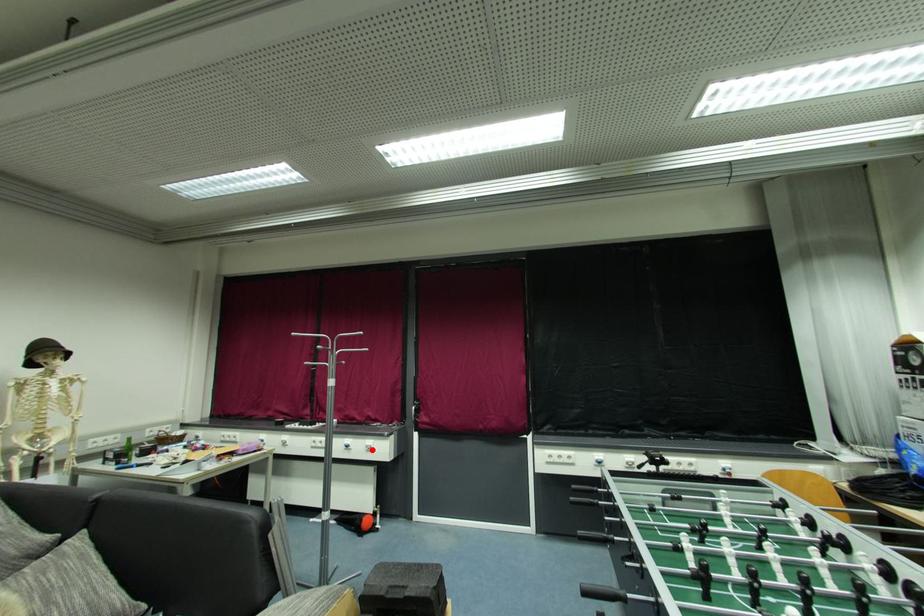
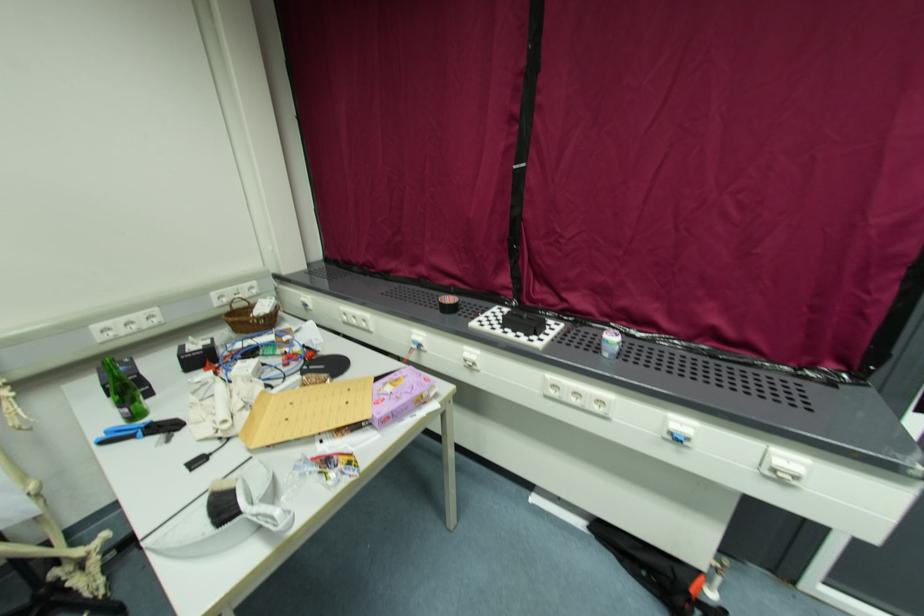
Locate, in the second image, the point that corresponds to the highlighted location in the first image.

(783, 477)